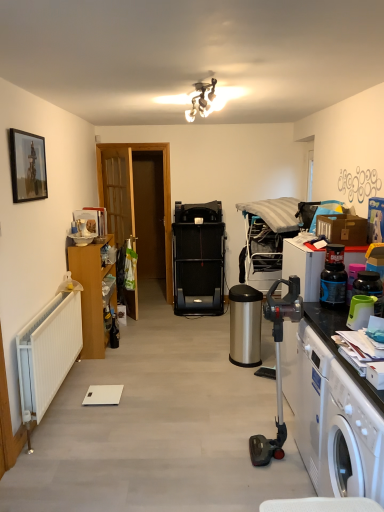
What do you see at coordinates (201, 99) in the screenshot? The image size is (384, 512). I see `metallic chrome light fixture at upper center` at bounding box center [201, 99].

What do you see at coordinates (333, 277) in the screenshot?
I see `blue plastic bottle at right` at bounding box center [333, 277].

Find the location of `blue plastic bottle at right`. blue plastic bottle at right is located at coordinates (333, 277).

At what (x,y) coordinates should I click in order to perform the action: click on metallic chrome light fixture at upper center. Please return your answer as a coordinate pair (x, y). Looking at the image, I should click on (201, 99).

Is metallic chrome light fixture at upper center thinner than blue plastic bottle at right?

In fact, metallic chrome light fixture at upper center might be wider than blue plastic bottle at right.

Is metallic chrome light fixture at upper center not inside blue plastic bottle at right?

That's correct, metallic chrome light fixture at upper center is outside of blue plastic bottle at right.

Is point (199, 109) in front of point (331, 264)?

No, (199, 109) is further to viewer.

Based on the photo, is metallic chrome light fixture at upper center far from blue plastic bottle at right?

metallic chrome light fixture at upper center is positioned a significant distance from blue plastic bottle at right.

Based on the photo, between wooden cabinet at left and wooden door at left, which one has more height?

wooden door at left.

Relative to wooden door at left, is wooden cabinet at left in front or behind?

In the image, wooden cabinet at left appears in front of wooden door at left.

In the scene shown: From the image's perspective, is wooden cabinet at left below wooden door at left?

Yes, from the image's perspective, wooden cabinet at left is beneath wooden door at left.

Is wooden cabinet at left looking in the opposite direction of wooden door at left?

No, wooden cabinet at left's orientation is not away from wooden door at left.

Identify the location of picture frame that is on the left side of metallic chrome light fixture at upper center. (27, 166).

From a real-world perspective, between matte black picture frame at upper left and metallic chrome light fixture at upper center, who is vertically lower?

In real-world perspective, matte black picture frame at upper left is lower.

Between matte black picture frame at upper left and metallic chrome light fixture at upper center, which one has more height?

With more height is matte black picture frame at upper left.

From the image's perspective, is matte black picture frame at upper left located above or below metallic chrome light fixture at upper center?

Clearly, from the image's perspective, matte black picture frame at upper left is below metallic chrome light fixture at upper center.

Is metallic gray vacuum cleaner at right oriented away from matte black picture frame at upper left?

No, metallic gray vacuum cleaner at right is not facing the opposite direction of matte black picture frame at upper left.

From a real-world perspective, is metallic gray vacuum cleaner at right below matte black picture frame at upper left?

Yes, from a real-world perspective, metallic gray vacuum cleaner at right is below matte black picture frame at upper left.

Based on the photo, from the image's perspective, is metallic gray vacuum cleaner at right below matte black picture frame at upper left?

Yes.

The image size is (384, 512). I want to click on cabinetry to the left of metallic chrome light fixture at upper center, so click(91, 296).

From the picture: Is metallic chrome light fixture at upper center further to the viewer compared to wooden cabinet at left?

No, metallic chrome light fixture at upper center is closer to the viewer.

Is metallic chrome light fixture at upper center aimed at wooden cabinet at left?

No, metallic chrome light fixture at upper center does not turn towards wooden cabinet at left.

Is metallic chrome light fixture at upper center in contact with wooden cabinet at left?

There is a gap between metallic chrome light fixture at upper center and wooden cabinet at left.

Would you say wooden door at left is part of blue plastic bottle at right's contents?

That's incorrect, wooden door at left is not inside blue plastic bottle at right.

Based on the photo, is blue plastic bottle at right facing towards wooden door at left?

No, blue plastic bottle at right is not turned towards wooden door at left.

Relative to wooden door at left, is blue plastic bottle at right in front or behind?

Clearly, blue plastic bottle at right is in front of wooden door at left.

Can you confirm if blue plastic bottle at right is shorter than wooden door at left?

Correct, blue plastic bottle at right is not as tall as wooden door at left.

Which of these two, white plastic washing machine at lower right or blue plastic bottle at right, stands shorter?

Standing shorter between the two is blue plastic bottle at right.

At what (x,y) coordinates should I click in order to perform the action: click on bottle on the right of white plastic washing machine at lower right. Please return your answer as a coordinate pair (x, y). Looking at the image, I should click on (333, 277).

From the image's perspective, is white plastic washing machine at lower right positioned above or below blue plastic bottle at right?

white plastic washing machine at lower right is situated lower than blue plastic bottle at right in the image.

From a real-world perspective, is white plastic washing machine at lower right positioned over blue plastic bottle at right based on gravity?

Incorrect, from a real-world perspective, white plastic washing machine at lower right is lower than blue plastic bottle at right.

In order to click on bottle lying behind the metallic chrome light fixture at upper center in this screenshot , I will do `click(333, 277)`.

Locate an element on the screen. This screenshot has height=512, width=384. cabinetry below the wooden door at left (from the image's perspective) is located at coordinates (91, 296).

Considering their positions, is white plastic washing machine at lower right positioned closer to metallic chrome light fixture at upper center than blue plastic bottle at right?

The object closer to metallic chrome light fixture at upper center is blue plastic bottle at right.

From the image, which object appears to be nearer to wooden door at left, white plastic washing machine at lower right or metallic gray vacuum cleaner at right?

metallic gray vacuum cleaner at right.

When comparing their distances from matte black picture frame at upper left, does metallic chrome light fixture at upper center or metallic gray vacuum cleaner at right seem further?

metallic gray vacuum cleaner at right lies further to matte black picture frame at upper left than the other object.

Based on their spatial positions, is wooden door at left or metallic gray vacuum cleaner at right further from metallic chrome light fixture at upper center?

The object further to metallic chrome light fixture at upper center is wooden door at left.

Considering their positions, is wooden door at left positioned further to matte black picture frame at upper left than metallic gray vacuum cleaner at right?

wooden door at left is positioned further to the anchor matte black picture frame at upper left.

Which object lies nearer to the anchor point metallic chrome light fixture at upper center, white plastic washing machine at lower right or matte black picture frame at upper left?

matte black picture frame at upper left.

Estimate the real-world distances between objects in this image. Which object is further from wooden door at left, metallic gray vacuum cleaner at right or blue plastic bottle at right?

The object further to wooden door at left is blue plastic bottle at right.

Estimate the real-world distances between objects in this image. Which object is closer to metallic chrome light fixture at upper center, wooden door at left or white plastic washing machine at lower right?

Based on the image, wooden door at left appears to be nearer to metallic chrome light fixture at upper center.

Where is `cabinetry that lies between metallic chrome light fixture at upper center and metallic gray vacuum cleaner at right from top to bottom`? The width and height of the screenshot is (384, 512). cabinetry that lies between metallic chrome light fixture at upper center and metallic gray vacuum cleaner at right from top to bottom is located at coordinates (91, 296).

Where is `appliance between matte black picture frame at upper left and blue plastic bottle at right from left to right`? appliance between matte black picture frame at upper left and blue plastic bottle at right from left to right is located at coordinates (277, 366).

Locate an element on the screen. The height and width of the screenshot is (512, 384). picture frame located between metallic chrome light fixture at upper center and wooden cabinet at left in the depth direction is located at coordinates (27, 166).

Find the location of a particular element. The width and height of the screenshot is (384, 512). cabinetry between matte black picture frame at upper left and blue plastic bottle at right from left to right is located at coordinates (91, 296).